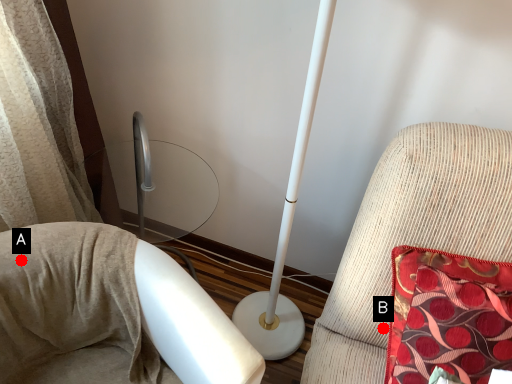
Question: Two points are circled on the image, labeled by A and B beside each circle. Which point appears farthest from the camera in this image?

Choices:
 (A) A is further
 (B) B is further

Answer: (B)